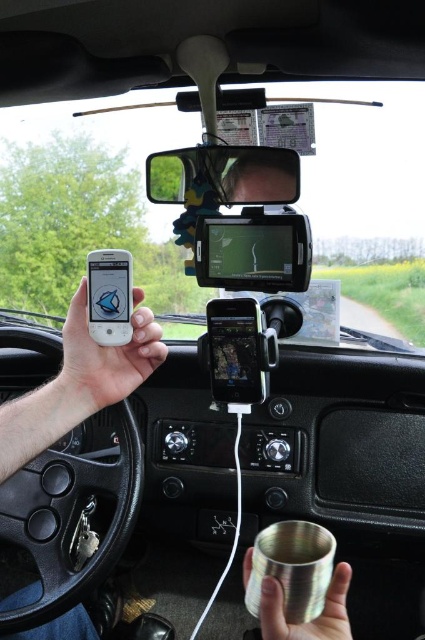
Can you confirm if matte black phone at upper left is taller than brushed metal cup at lower center?

Yes, matte black phone at upper left is taller than brushed metal cup at lower center.

Does matte black phone at upper left come behind brushed metal cup at lower center?

Yes, it is behind brushed metal cup at lower center.

Does point (99, 305) come behind point (260, 621)?

That is True.

This screenshot has width=425, height=640. Identify the location of matte black phone at upper left. (110, 296).

Between white matte phone at center left and clear plastic view mirror at upper center, which one has less height?

white matte phone at center left

I want to click on white matte phone at center left, so click(x=104, y=360).

The width and height of the screenshot is (425, 640). I want to click on white matte phone at center left, so click(104, 360).

Is point (175, 182) farther from camera compared to point (251, 548)?

That is True.

The height and width of the screenshot is (640, 425). In order to click on clear plastic view mirror at upper center in this screenshot , I will do `click(224, 173)`.